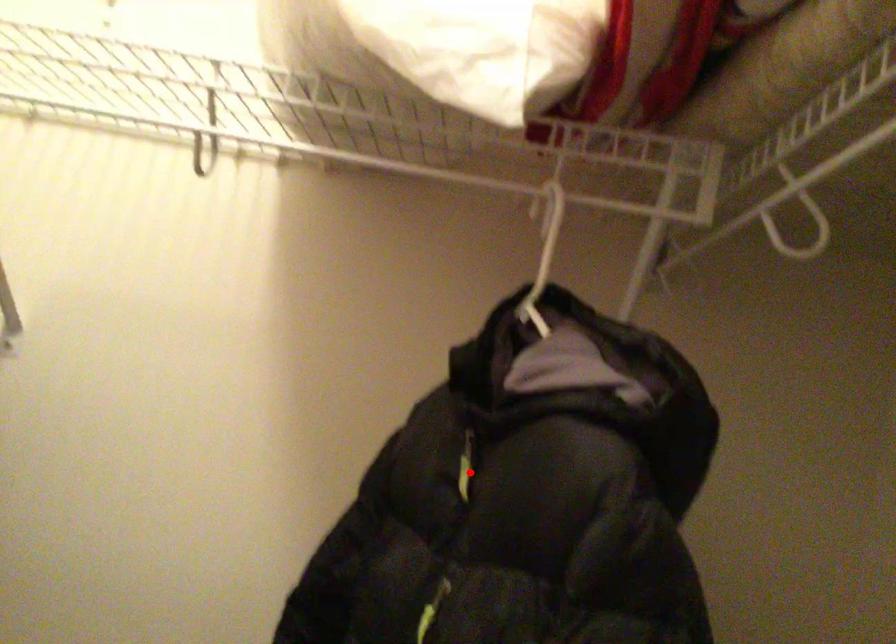
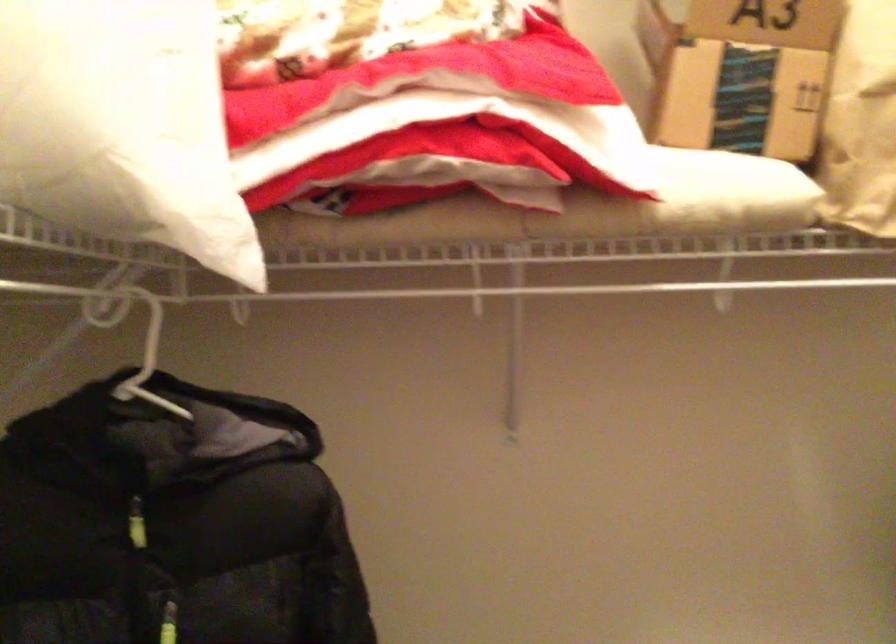
Question: I am providing you with two images of the same scene from different viewpoints. Image1 has a red point marked. In image2, the corresponding 3D location appears at what relative position? Reply with the corresponding letter.

Choices:
 (A) Closer
 (B) Farther

Answer: (B)